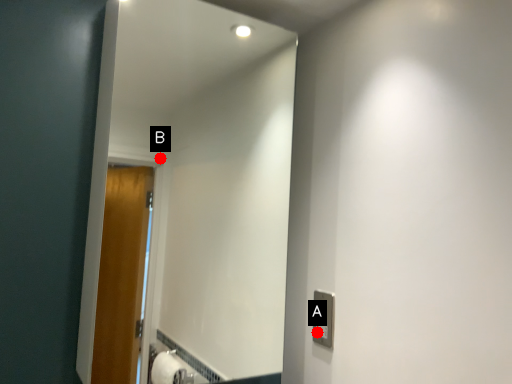
Question: Two points are circled on the image, labeled by A and B beside each circle. Which point is farther from the camera taking this photo?

Choices:
 (A) A is further
 (B) B is further

Answer: (B)